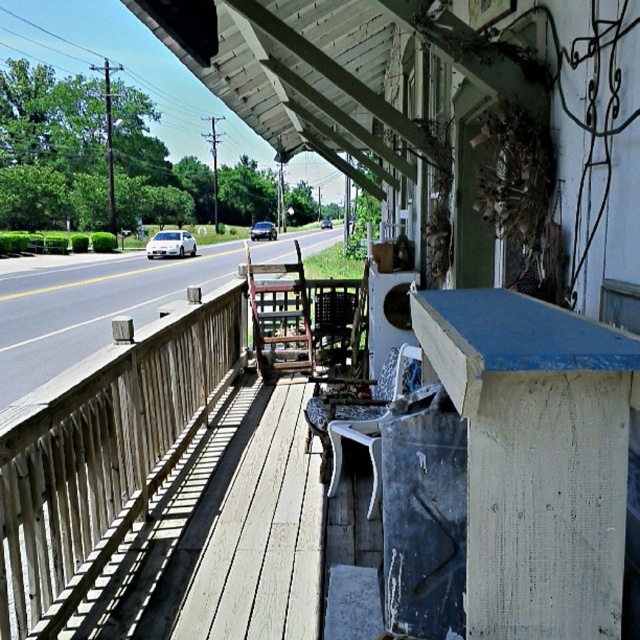
Question: Which of the following is the closest to the observer?

Choices:
 (A) (344, 371)
 (B) (420, 388)

Answer: (B)

Question: Does white plastic rocking chair at center appear over wooden chair at center?

Choices:
 (A) no
 (B) yes

Answer: (A)

Question: Is white plastic rocking chair at center thinner than wooden chair at center?

Choices:
 (A) yes
 (B) no

Answer: (B)

Question: Which of the following is the farthest from the observer?

Choices:
 (A) (332, 348)
 (B) (380, 486)

Answer: (A)

Question: Is white plastic rocking chair at center thinner than wooden chair at center?

Choices:
 (A) yes
 (B) no

Answer: (B)